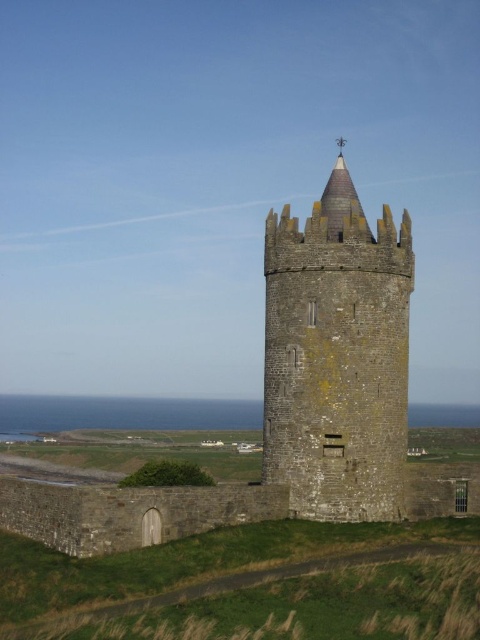
You are standing at the base of the stone tower at center. If you walk directly towards the point marked by coordinates point (290, 403), will you be moving away from the tower or towards it?

The stone tower at center is represented by point (290, 403). Therefore, walking directly towards this point means you are moving towards the tower.